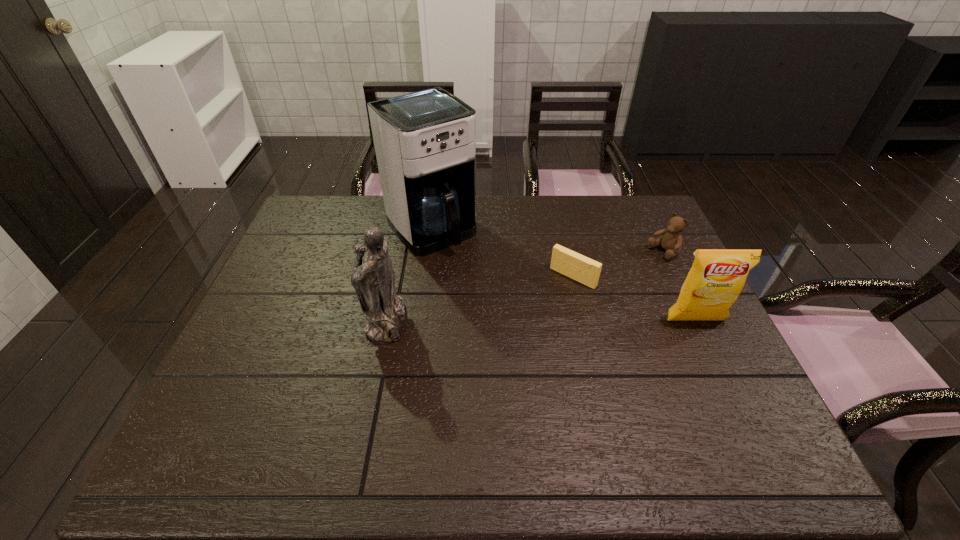
Find the location of a particular element. Image resolution: width=960 pixels, height=540 pixels. free space that satisfies the following two spatial constraints: 1. on the back side of the teddy bear; 2. on the left side of the videotape is located at coordinates (567, 252).